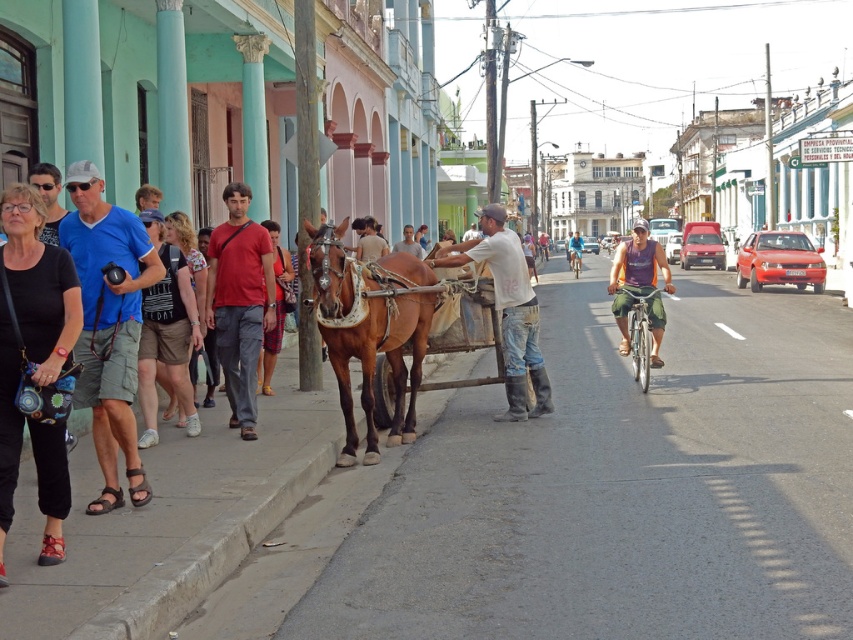
Can you confirm if blue cotton shirt at left is thinner than purple fabric shirt at center?

Correct, blue cotton shirt at left's width is less than purple fabric shirt at center's.

Between blue cotton shirt at left and purple fabric shirt at center, which one appears on the right side from the viewer's perspective?

From the viewer's perspective, purple fabric shirt at center appears more on the right side.

Between point (149, 490) and point (645, 264), which one is positioned in front?

Point (149, 490)

The height and width of the screenshot is (640, 853). I want to click on blue cotton shirt at left, so 108,324.

Does matte red shirt at center appear on the right side of white cotton shirt at center?

In fact, matte red shirt at center is to the left of white cotton shirt at center.

Between matte red shirt at center and white cotton shirt at center, which one is positioned higher?

white cotton shirt at center is higher up.

Is point (230, 416) farther from camera compared to point (509, 346)?

No, (230, 416) is in front of (509, 346).

Where is `matte red shirt at center`? The width and height of the screenshot is (853, 640). matte red shirt at center is located at coordinates (239, 301).

Is point (223, 330) positioned in front of point (631, 228)?

Yes, point (223, 330) is in front of point (631, 228).

Which is more to the right, matte red shirt at center or purple fabric shirt at center?

purple fabric shirt at center

Does point (225, 266) come closer to viewer compared to point (636, 250)?

Yes, point (225, 266) is closer to viewer.

The width and height of the screenshot is (853, 640). What are the coordinates of `matte red shirt at center` in the screenshot? It's located at (239, 301).